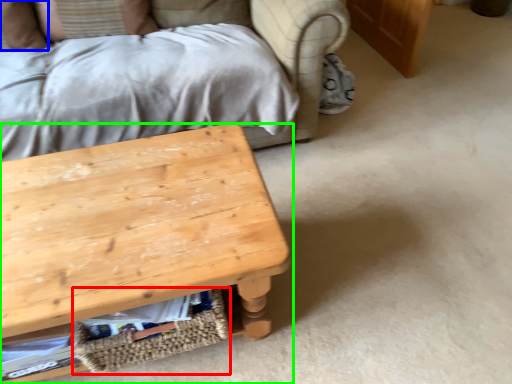
Question: Which object is positioned closest to basket (highlighted by a red box)? Select from pillow (highlighted by a blue box) and table (highlighted by a green box).

Choices:
 (A) pillow
 (B) table

Answer: (B)